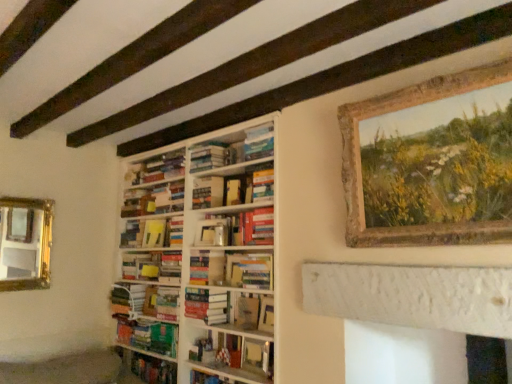
You are a GUI agent. You are given a task and a screenshot of the screen. Output one action in this format:
    pyautogui.click(x=<x>, y=<y>)
    Task: Click on the hardcover book at center, which ranks as the 7th book in top-to-bottom order
    
    Given the screenshot: What is the action you would take?
    161,302

Locate an element on the screen. hardcover book at center, arranged as the fifth paperback book when ordered from the bottom is located at coordinates (208, 192).

I want to click on yellow paper at center, the 2th paperback book in the bottom-to-top sequence, so click(154, 233).

You are a GUI agent. You are given a task and a screenshot of the screen. Output one action in this format:
    pyautogui.click(x=<x>, y=<y>)
    Task: Click on the hardcover book at center, the third paperback book when ordered from top to bottom
    
    Given the screenshot: What is the action you would take?
    tap(258, 226)

Which object is wider, hardcover book at center, acting as the 3th paperback book starting from the bottom, or green matte book at center, which is counted as the first book, starting from the bottom?

green matte book at center, which is counted as the first book, starting from the bottom.

Is hardcover book at center, acting as the 3th paperback book starting from the bottom, not close to green matte book at center, which is counted as the first book, starting from the bottom?

They are positioned close to each other.

Would you say hardcover book at center, acting as the 3th paperback book starting from the bottom, is to the left or to the right of green matte book at center, which is counted as the first book, starting from the bottom, in the picture?

From the image, it's evident that hardcover book at center, acting as the 3th paperback book starting from the bottom, is to the right of green matte book at center, which is counted as the first book, starting from the bottom.

Is hardcover book at center, the 8th book viewed from the top, next to hardcover book at center, arranged as the fifth paperback book when ordered from the bottom, and touching it?

hardcover book at center, the 8th book viewed from the top, is not next to hardcover book at center, arranged as the fifth paperback book when ordered from the bottom, and they're not touching.

Based on the photo, is hardcover book at center, positioned as the 2th book in bottom-to-top order, oriented towards hardcover book at center, the second paperback book when ordered from top to bottom?

No, hardcover book at center, positioned as the 2th book in bottom-to-top order, does not turn towards hardcover book at center, the second paperback book when ordered from top to bottom.

From a real-world perspective, who is located higher, hardcover book at center, the 8th book viewed from the top, or hardcover book at center, the second paperback book when ordered from top to bottom?

hardcover book at center, the second paperback book when ordered from top to bottom.

From a real-world perspective, is hardcover books at center, which is counted as the 1th book, starting from the top, under hardcover book at center, acting as the fourth book starting from the bottom?

Incorrect, from a real-world perspective, hardcover books at center, which is counted as the 1th book, starting from the top, is higher than hardcover book at center, acting as the fourth book starting from the bottom.

How different are the orientations of hardcover books at center, which is counted as the 1th book, starting from the top, and hardcover book at center, acting as the fourth book starting from the bottom, in degrees?

0.46 degrees.

Is hardcover books at center, which is counted as the 1th book, starting from the top, next to hardcover book at center, acting as the fourth book starting from the bottom?

No, hardcover books at center, which is counted as the 1th book, starting from the top, is not in contact with hardcover book at center, acting as the fourth book starting from the bottom.

Is hardcover books at center, which is counted as the 1th book, starting from the top, behind hardcover book at center, acting as the fourth book starting from the bottom?

No, hardcover books at center, which is counted as the 1th book, starting from the top, is in front of hardcover book at center, acting as the fourth book starting from the bottom.

From the picture: Is hardcover book at center, positioned as the fifth book in bottom-to-top order, shorter than hardcover book at center, the third book ordered from the bottom?

Correct, hardcover book at center, positioned as the fifth book in bottom-to-top order, is not as tall as hardcover book at center, the third book ordered from the bottom.

Which is more to the left, hardcover book at center, positioned as the fifth book in bottom-to-top order, or hardcover book at center, the third book ordered from the bottom?

From the viewer's perspective, hardcover book at center, the third book ordered from the bottom, appears more on the left side.

From the image's perspective, is hardcover book at center, positioned as the fifth book in bottom-to-top order, on hardcover book at center, which ranks as the 7th book in top-to-bottom order?

Yes, from the image's perspective, hardcover book at center, positioned as the fifth book in bottom-to-top order, is over hardcover book at center, which ranks as the 7th book in top-to-bottom order.

Considering the positions of point (196, 293) and point (151, 314), is point (196, 293) closer or farther from the camera than point (151, 314)?

Point (196, 293) is closer to the camera than point (151, 314).

From a real-world perspective, is hardcover book at center, acting as the fourth book starting from the bottom, located higher than hardcover book at center, the third paperback book when ordered from top to bottom?

Incorrect, from a real-world perspective, hardcover book at center, acting as the fourth book starting from the bottom, is lower than hardcover book at center, the third paperback book when ordered from top to bottom.

Is hardcover book at center, acting as the fourth book starting from the bottom, inside the boundaries of hardcover book at center, positioned as the 4th paperback book in bottom-to-top order, or outside?

hardcover book at center, acting as the fourth book starting from the bottom, is located beyond the bounds of hardcover book at center, positioned as the 4th paperback book in bottom-to-top order.

Is the surface of hardcover book at center, placed as the sixth book when sorted from top to bottom, in direct contact with hardcover book at center, positioned as the 4th paperback book in bottom-to-top order?

No, hardcover book at center, placed as the sixth book when sorted from top to bottom, is not touching hardcover book at center, positioned as the 4th paperback book in bottom-to-top order.

How many degrees apart are the facing directions of hardcover book at center, placed as the sixth book when sorted from top to bottom, and hardcover book at center, the third paperback book when ordered from top to bottom?

The angular difference between hardcover book at center, placed as the sixth book when sorted from top to bottom, and hardcover book at center, the third paperback book when ordered from top to bottom, is 0.401 degrees.

Does hardcover book at center, the third book ordered from the bottom, turn towards white wooden bookcase at center?

Yes, hardcover book at center, the third book ordered from the bottom, is facing white wooden bookcase at center.

Who is more distant, hardcover book at center, which ranks as the 7th book in top-to-bottom order, or white wooden bookcase at center?

hardcover book at center, which ranks as the 7th book in top-to-bottom order, is more distant.

Is hardcover book at center, which ranks as the 7th book in top-to-bottom order, completely or partially outside of white wooden bookcase at center?

Actually, hardcover book at center, which ranks as the 7th book in top-to-bottom order, is at least partially inside white wooden bookcase at center.

From a real-world perspective, does hardcover book at center, which ranks as the 7th book in top-to-bottom order, sit lower than white wooden bookcase at center?

Yes, from a real-world perspective, hardcover book at center, which ranks as the 7th book in top-to-bottom order, is under white wooden bookcase at center.

Is hardcover book at center, the 8th book viewed from the top, at the back of gold-framed mirror at lower left?

No, gold-framed mirror at lower left's orientation is not away from hardcover book at center, the 8th book viewed from the top.

Is gold-framed mirror at lower left beside hardcover book at center, positioned as the 2th book in bottom-to-top order?

No, gold-framed mirror at lower left is not making contact with hardcover book at center, positioned as the 2th book in bottom-to-top order.

From a real-world perspective, is gold-framed mirror at lower left physically located above or below hardcover book at center, the 8th book viewed from the top?

gold-framed mirror at lower left is above hardcover book at center, the 8th book viewed from the top.

Which is farther from the camera, [33,277] or [233,344]?

The point [33,277] is more distant.

The image size is (512, 384). Identify the location of the 2nd paperback book directly above the green matte book at center, placed as the ninth book when sorted from top to bottom (from a real-world perspective). (213, 232).

Locate an element on the screen. the 4th book in front of the hardcover book at center, arranged as the fifth paperback book when ordered from the bottom is located at coordinates (236, 356).

Which object lies further to the anchor point hardcover book at center, acting as the 3th paperback book starting from the bottom, hardcover book at center, which ranks as the 5th book in top-to-bottom order, or hardcover books at center, the 8th book from the bottom?

The object further to hardcover book at center, acting as the 3th paperback book starting from the bottom, is hardcover books at center, the 8th book from the bottom.

Estimate the real-world distances between objects in this image. Which object is further from hardcover book at center, the second paperback book when ordered from top to bottom, hardcover book at center, the seventh book positioned from the bottom, or hardcover book at center, which appears as the first paperback book when ordered from the bottom?

hardcover book at center, which appears as the first paperback book when ordered from the bottom, lies further to hardcover book at center, the second paperback book when ordered from top to bottom, than the other object.

When comparing their distances from wooden rustic frame at upper right, does hardcover book at center, positioned as the fifth book in bottom-to-top order, or hardcover book at center, acting as the 3th paperback book starting from the bottom, seem closer?

Based on the image, hardcover book at center, acting as the 3th paperback book starting from the bottom, appears to be nearer to wooden rustic frame at upper right.

Which object lies further to the anchor point hardcover book at center, the third book ordered from the bottom, hardcover book at center, arranged as the fifth paperback book when ordered from the bottom, or hardcover book at center, positioned as the 4th paperback book in bottom-to-top order?

hardcover book at center, positioned as the 4th paperback book in bottom-to-top order, lies further to hardcover book at center, the third book ordered from the bottom, than the other object.

Which object lies further to the anchor point hardcover book at center, which ranks as the 5th book in top-to-bottom order, yellow paper at center, the 2th paperback book in the bottom-to-top sequence, or green matte book at center, placed as the ninth book when sorted from top to bottom?

yellow paper at center, the 2th paperback book in the bottom-to-top sequence.

Considering their positions, is hardcover book at center, the 8th book viewed from the top, positioned closer to hardcover book at center, acting as the 3th paperback book starting from the bottom, than hardcover book at center, positioned as the fifth book in bottom-to-top order?

Among the two, hardcover book at center, positioned as the fifth book in bottom-to-top order, is located nearer to hardcover book at center, acting as the 3th paperback book starting from the bottom.

In the scene shown: Which object lies further to the anchor point hardcover book at center, acting as the fourth book starting from the bottom, green matte book at center, placed as the ninth book when sorted from top to bottom, or hardcover book at center, the 8th book viewed from the top?

hardcover book at center, the 8th book viewed from the top.

When comparing their distances from hardcover book at center, which ranks as the 5th book in top-to-bottom order, does wooden rustic frame at upper right or white wooden bookcase at center seem closer?

The object closer to hardcover book at center, which ranks as the 5th book in top-to-bottom order, is white wooden bookcase at center.

The image size is (512, 384). I want to click on bookcase between gold-framed mirror at lower left and hardcover book at center, positioned as the 4th paperback book in bottom-to-top order, from left to right, so click(199, 266).

Locate an element on the screen. paperback book situated between gold-framed mirror at lower left and white wooden bookcase at center from left to right is located at coordinates (154, 233).

The height and width of the screenshot is (384, 512). Identify the location of paperback book between wooden rustic frame at upper right and hardcover book at upper center, acting as the sixth paperback book starting from the bottom, along the z-axis. (258, 226).

Where is `bookcase located between hardcover book at center, acting as the fourth book starting from the bottom, and wooden rustic frame at upper right in the left-right direction`? The width and height of the screenshot is (512, 384). bookcase located between hardcover book at center, acting as the fourth book starting from the bottom, and wooden rustic frame at upper right in the left-right direction is located at coordinates (199, 266).